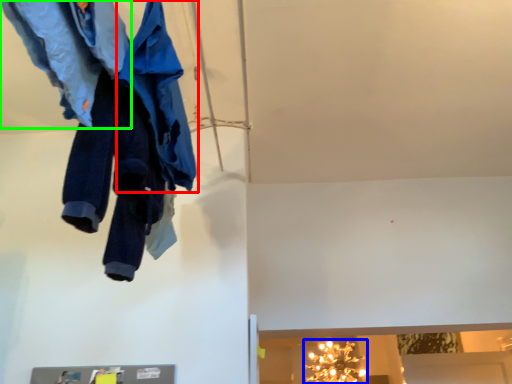
Question: Considering the real-world distances, which object is closest to cloak (highlighted by a red box)? light fixture (highlighted by a blue box) or trousers (highlighted by a green box).

Choices:
 (A) light fixture
 (B) trousers

Answer: (B)